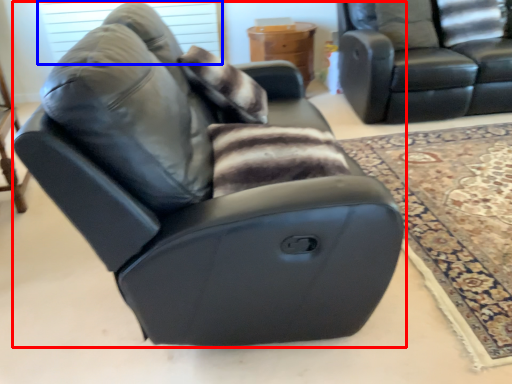
Question: Which point is closer to the camera, chair (highlighted by a red box) or window screen (highlighted by a blue box)?

Choices:
 (A) chair
 (B) window screen

Answer: (A)